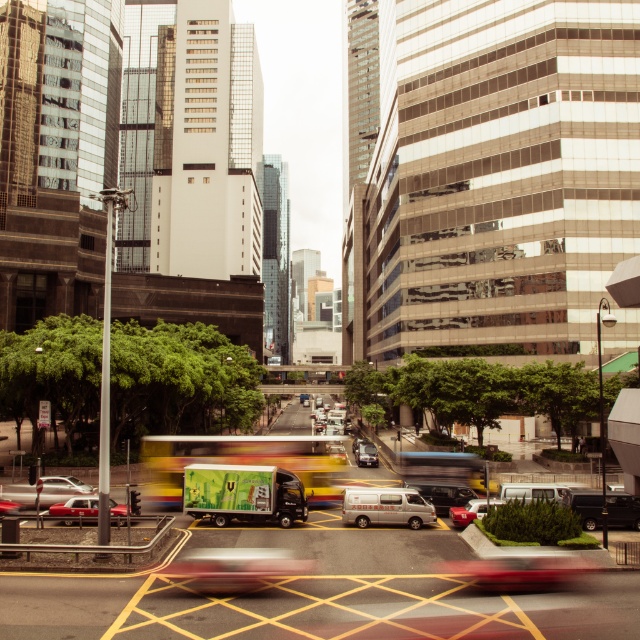
You are a pedestrian standing at the intersection and want to cross the street. You notice a silver metallic sedan at lower left and a shiny red car at center. Which car is closer to you?

The silver metallic sedan at lower left is closer to you because it is shorter than the shiny red car at center, which means it is positioned nearer in the scene.

You are a pedestrian waiting at the intersection and want to cross the street. There is a silver metallic sedan at lower left and a shiny red car at center. Which vehicle is closer to you?

The silver metallic sedan at lower left is closer to you since it is smaller in size compared to the shiny red car at center, indicating it is nearer.